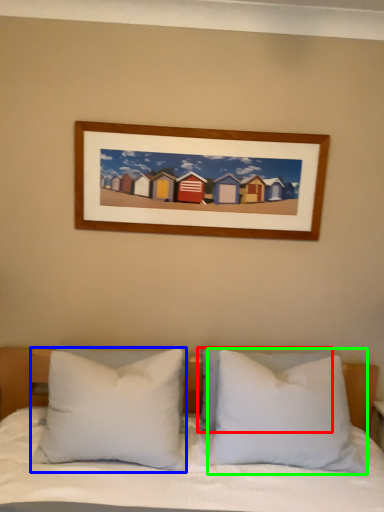
Question: Which object is positioned farthest from pillow (highlighted by a red box)? Select from pillow (highlighted by a blue box) and pillow (highlighted by a green box).

Choices:
 (A) pillow
 (B) pillow

Answer: (A)